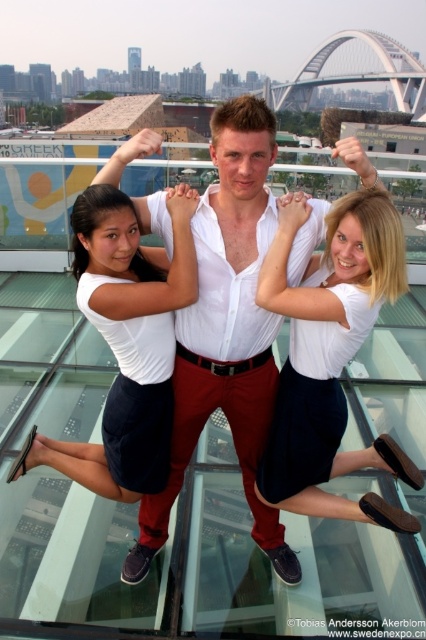
Which is behind, point (284, 294) or point (158, 317)?

The point (158, 317) is behind.

Who is higher up, white cotton skirt at center or white cotton shirt at center?

white cotton shirt at center is above.

Locate an element on the screen. This screenshot has width=426, height=640. white cotton skirt at center is located at coordinates (331, 358).

The width and height of the screenshot is (426, 640). In order to click on white cotton skirt at center in this screenshot , I will do `click(331, 358)`.